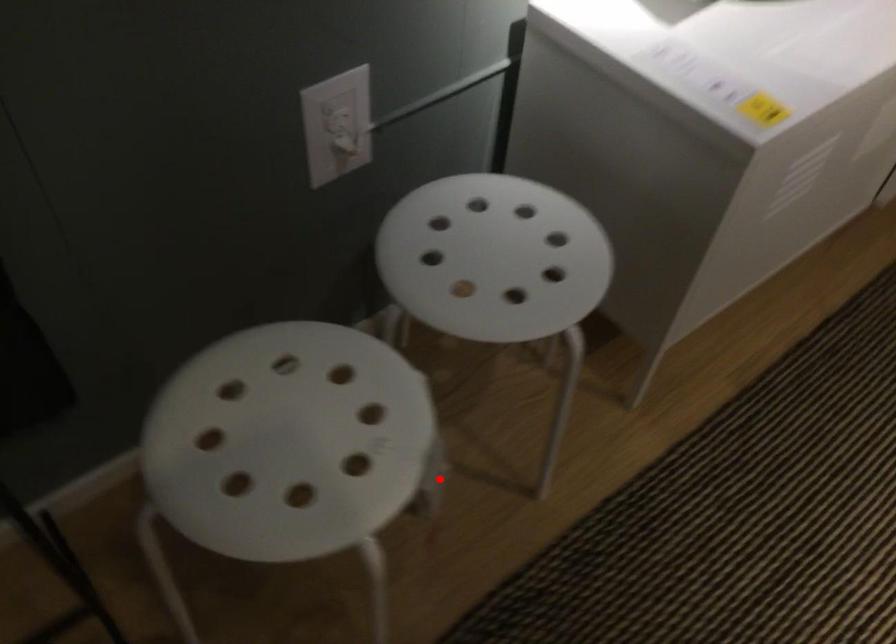
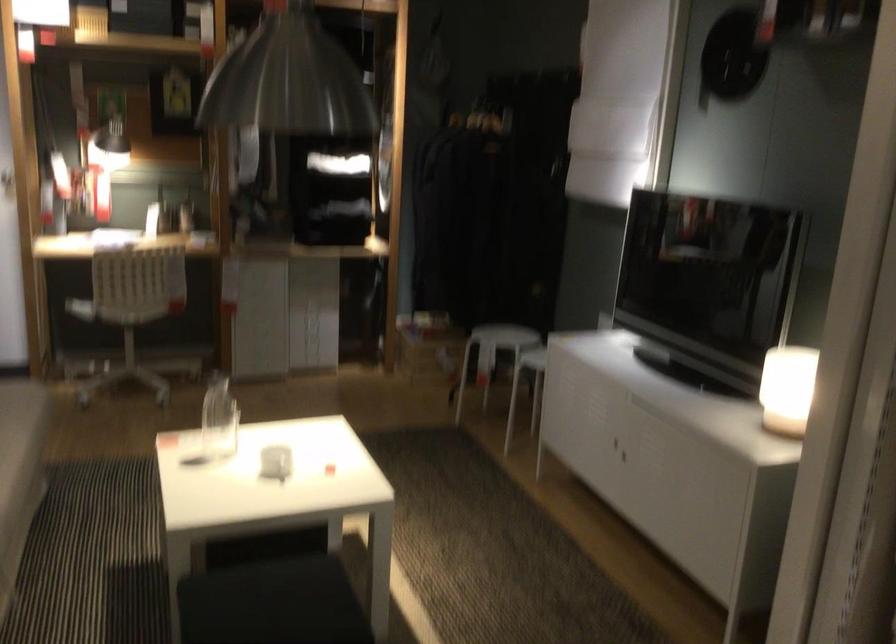
Locate, in the second image, the point that corresponds to the highlighted location in the first image.

(492, 355)